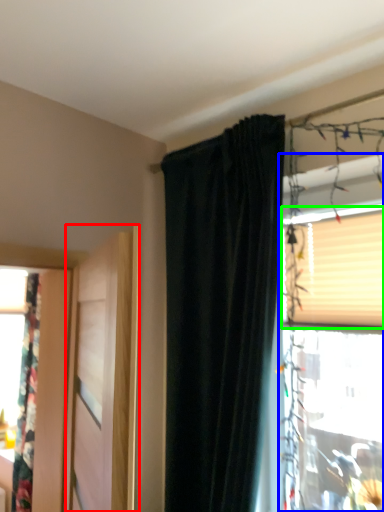
Question: Considering the real-world distances, which object is farthest from door (highlighted by a red box)? window (highlighted by a blue box) or blind (highlighted by a green box)?

Choices:
 (A) window
 (B) blind

Answer: (B)